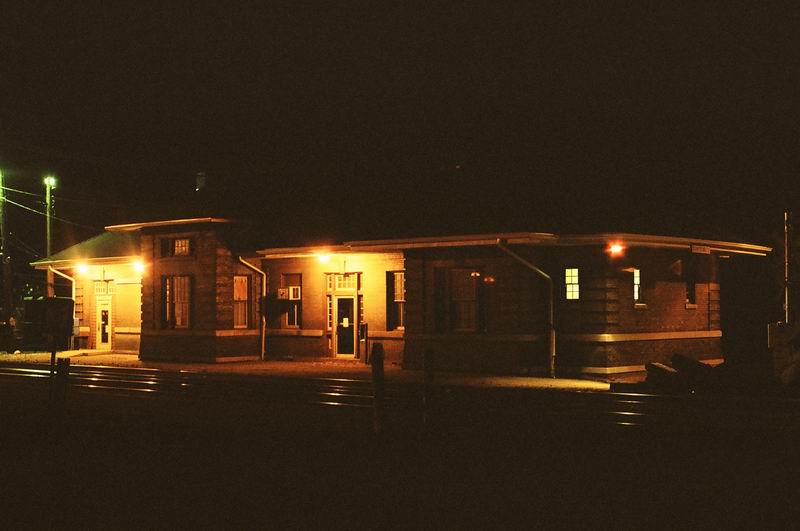
In order to click on door in this screenshot , I will do `click(106, 326)`, `click(342, 333)`.